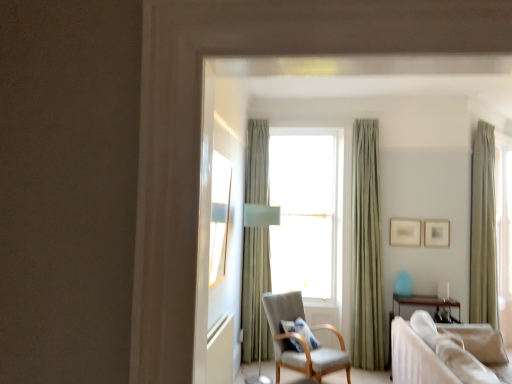
Question: Considering the relative sizes of green velvet curtain at right, which is the 1th curtain in right-to-left order, and beige fabric couch at lower right in the image provided, is green velvet curtain at right, which is the 1th curtain in right-to-left order, wider than beige fabric couch at lower right?

Choices:
 (A) yes
 (B) no

Answer: (B)

Question: From a real-world perspective, is green velvet curtain at right, which is the 1th curtain in right-to-left order, on top of beige fabric couch at lower right?

Choices:
 (A) no
 (B) yes

Answer: (B)

Question: From the image's perspective, does green velvet curtain at right, which is the 1th curtain in right-to-left order, appear higher than beige fabric couch at lower right?

Choices:
 (A) yes
 (B) no

Answer: (A)

Question: Is green velvet curtain at right, which is counted as the 3th curtain, starting from the left, facing away from beige fabric couch at lower right?

Choices:
 (A) no
 (B) yes

Answer: (A)

Question: Can you confirm if green velvet curtain at right, which is counted as the 3th curtain, starting from the left, is positioned to the right of beige fabric couch at lower right?

Choices:
 (A) yes
 (B) no

Answer: (A)

Question: Could you tell me if green velvet curtain at right, which is counted as the 3th curtain, starting from the left, is facing beige fabric couch at lower right?

Choices:
 (A) yes
 (B) no

Answer: (B)

Question: Is matte gold picture frame at center right, which is the first picture frame from left to right, at the back of sage green fabric curtain at center, acting as the 2th curtain starting from the left?

Choices:
 (A) yes
 (B) no

Answer: (B)

Question: Is sage green fabric curtain at center, acting as the 2th curtain starting from the left, outside matte gold picture frame at center right, which is the first picture frame from left to right?

Choices:
 (A) yes
 (B) no

Answer: (A)

Question: Can you see sage green fabric curtain at center, the second curtain from the right, touching matte gold picture frame at center right, which is the first picture frame from left to right?

Choices:
 (A) no
 (B) yes

Answer: (A)

Question: Would you say sage green fabric curtain at center, the second curtain from the right, contains matte gold picture frame at center right, placed as the 2th picture frame when sorted from right to left?

Choices:
 (A) yes
 (B) no

Answer: (B)

Question: Does sage green fabric curtain at center, acting as the 2th curtain starting from the left, have a larger size compared to matte gold picture frame at center right, which is the first picture frame from left to right?

Choices:
 (A) no
 (B) yes

Answer: (B)

Question: Is the position of sage green fabric curtain at center, the second curtain from the right, more distant than that of matte gold picture frame at center right, placed as the 2th picture frame when sorted from right to left?

Choices:
 (A) no
 (B) yes

Answer: (A)

Question: Is sage green fabric curtain at center, acting as the 2th curtain starting from the left, further to camera compared to green velvet curtain at right, which is counted as the 3th curtain, starting from the left?

Choices:
 (A) no
 (B) yes

Answer: (B)